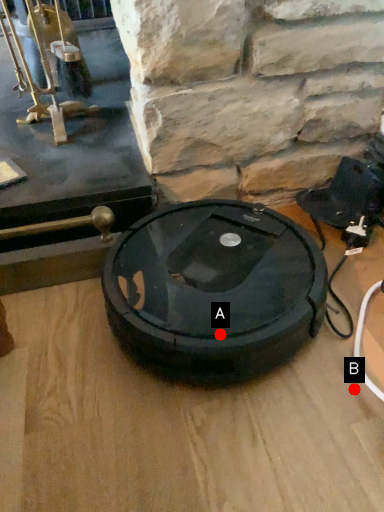
Question: Two points are circled on the image, labeled by A and B beside each circle. Which point is farther from the camera taking this photo?

Choices:
 (A) A is further
 (B) B is further

Answer: (B)